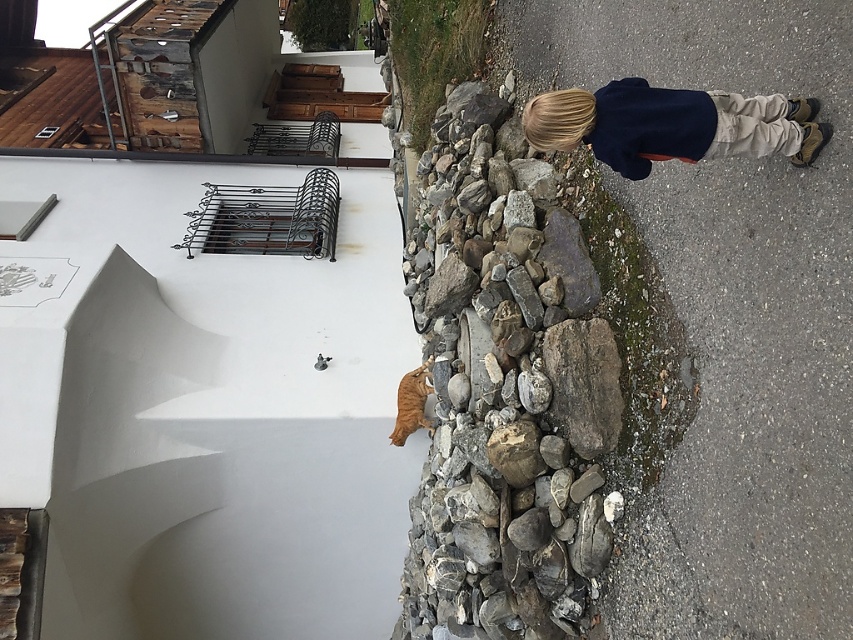
Can you confirm if rough gray rock at center is bigger than dark blue sweater at upper right?

Correct, rough gray rock at center is larger in size than dark blue sweater at upper right.

Which is below, rough gray rock at center or dark blue sweater at upper right?

rough gray rock at center

Does point (447, 524) lie in front of point (706, 113)?

That is False.

Identify the location of rough gray rock at center. The width and height of the screenshot is (853, 640). (503, 403).